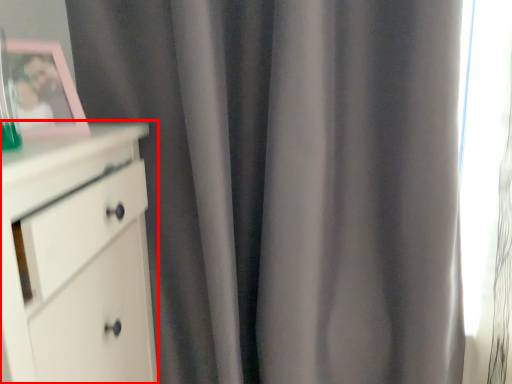
Question: From the image's perspective, what is the correct spatial positioning of chest of drawers (annotated by the red box) in reference to picture frame?

Choices:
 (A) above
 (B) below

Answer: (B)